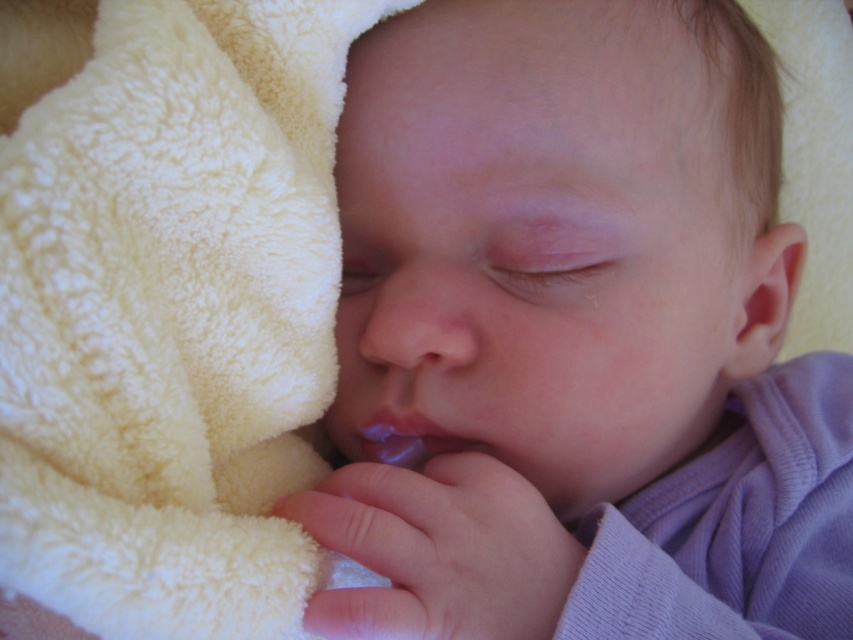
Question: Does creamy soft blanket at left appear on the left side of smooth skin nose at center?

Choices:
 (A) yes
 (B) no

Answer: (A)

Question: In this image, where is smooth purple cloth at center located relative to smooth skin nose at center?

Choices:
 (A) left
 (B) right

Answer: (B)

Question: Which is nearer to the creamy soft blanket at left?

Choices:
 (A) smooth purple cloth at center
 (B) purple glossy lips at center
 (C) smooth skin nose at center

Answer: (C)

Question: Estimate the real-world distances between objects in this image. Which object is farther from the smooth skin nose at center?

Choices:
 (A) purple glossy lips at center
 (B) creamy soft blanket at left

Answer: (B)

Question: From the image, what is the correct spatial relationship of creamy soft blanket at left in relation to purple glossy lips at center?

Choices:
 (A) above
 (B) below

Answer: (A)

Question: Which point appears closest to the camera in this image?

Choices:
 (A) (374, 371)
 (B) (16, 419)

Answer: (B)